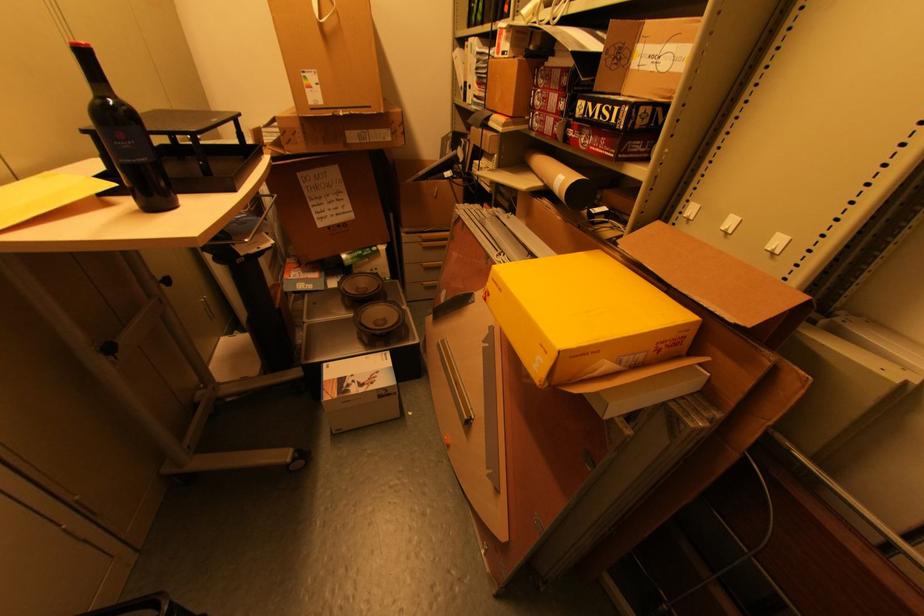
Where would you lift the bag handle? Please return your answer as a coordinate pair (x, y).

(322, 10)